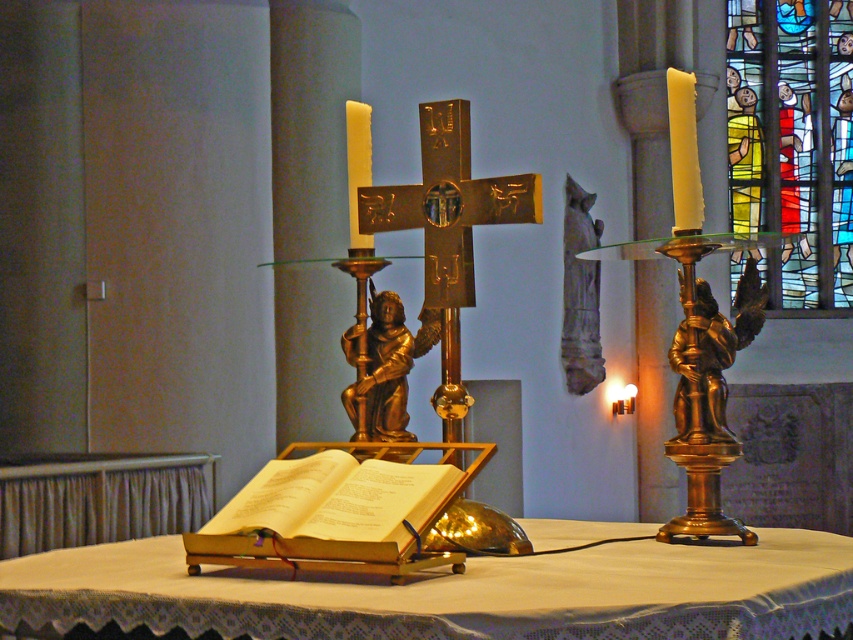
Question: Estimate the real-world distances between objects in this image. Which object is farther from the white wax candle at center?

Choices:
 (A) gold polished angel statue at center
 (B) gold polished angel at right

Answer: (B)

Question: Which point is closer to the camera?

Choices:
 (A) (692, 132)
 (B) (695, 346)
 (C) (772, 17)
 (D) (399, 342)

Answer: (A)

Question: Can you confirm if white wax candle at right is wider than white wax candle at center?

Choices:
 (A) yes
 (B) no

Answer: (A)

Question: Is stained glass figures at upper right to the left of stone statue at upper center from the viewer's perspective?

Choices:
 (A) yes
 (B) no

Answer: (B)

Question: Which point is closer to the camera?

Choices:
 (A) gold polished angel statue at center
 (B) white wax candle at right

Answer: (B)

Question: Does yellow paper book at center have a lesser width compared to gold polished angel statue at center?

Choices:
 (A) yes
 (B) no

Answer: (B)